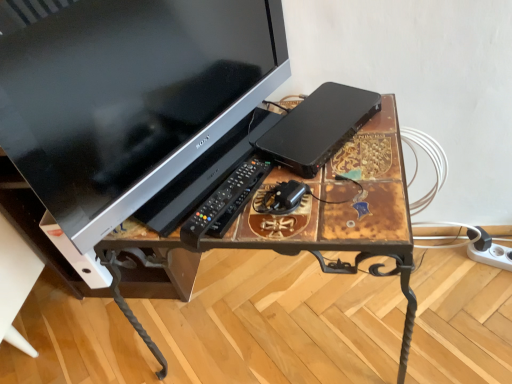
At what (x,y) coordinates should I click in order to perform the action: click on free space in front of black plastic remote at center. Please return your answer as a coordinate pair (x, y). Looking at the image, I should click on tap(254, 233).